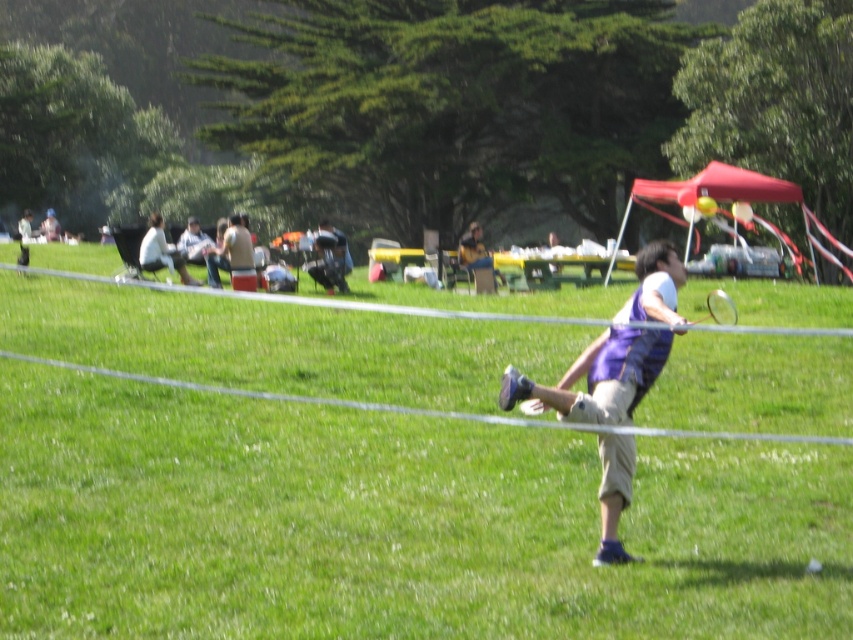
Based on the photo, you are a fashion designer observing the person playing badminton in the park. You notice two purple garments on them. Which garment is positioned lower on their body, the purple striped vest at center or the purple fabric shirt at center?

The purple striped vest at center is located below the purple fabric shirt at center, so the purple striped vest at center is positioned lower on their body.

You are a photographer trying to capture a wide shot of the green grassy field at center and the purple striped vest at center. Which object should you focus on first if you want to ensure both are in the frame?

The green grassy field at center has a larger size compared to purple striped vest at center, so you should focus on the green grassy field at center first to ensure it fits in the frame before adjusting for the smaller purple striped vest at center.